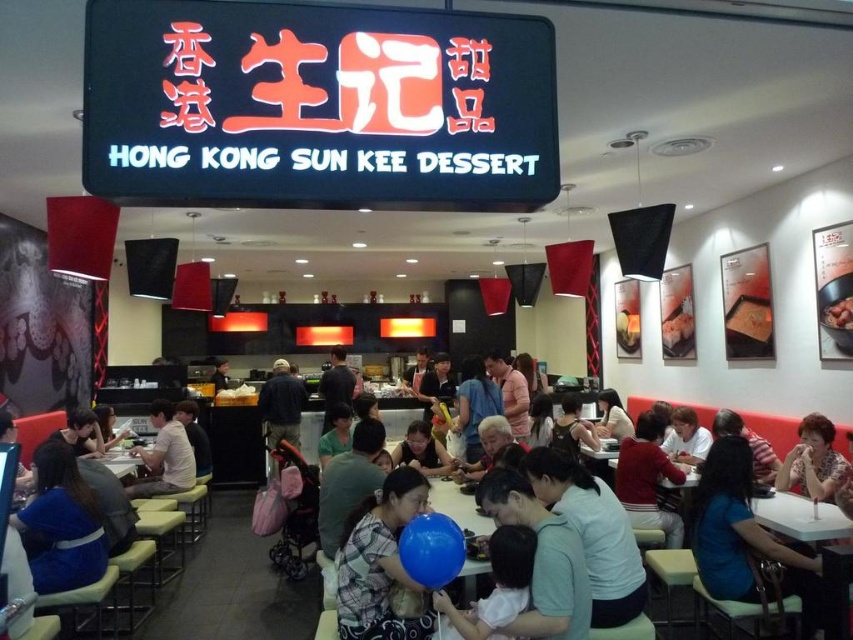
Consider the image. You are a customer in the dessert restaurant and want to sit down. You see a blue fabric shirt at lower right and a white plastic table at lower left. Which object is thinner?

The blue fabric shirt at lower right is thinner than the white plastic table at lower left.

From the picture: You are a customer sitting at the white plastic table at lower left and want to hand your phone to someone wearing the blue fabric shirt at lower right. Can you directly hand it to them without getting up?

The blue fabric shirt at lower right is in front of the white plastic table at lower left, meaning the person wearing it is closer to you. Since they are in front of your table, you can likely reach them by extending your arm without needing to stand up.